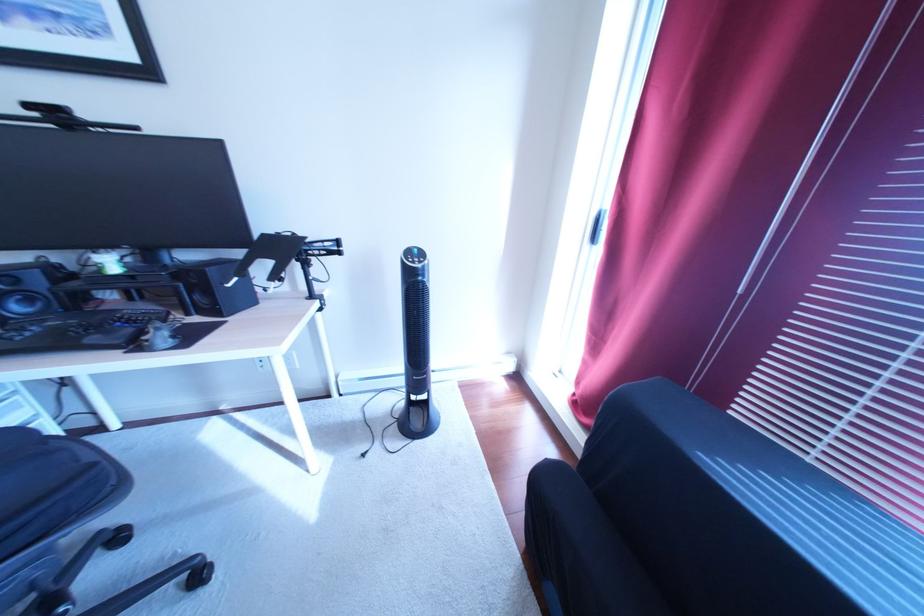
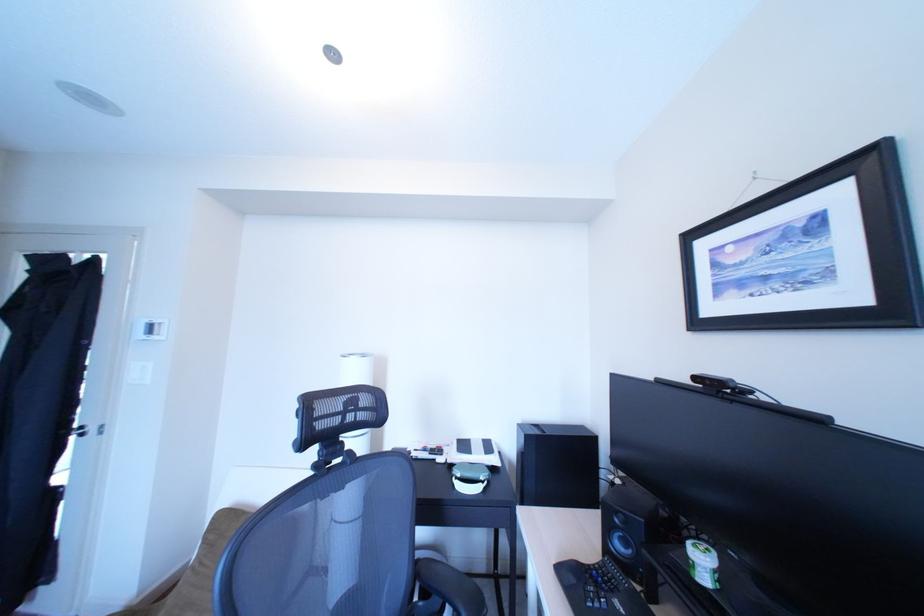
Question: The camera is either moving clockwise (left) or counter-clockwise (right) around the object. The first image is from the beginning of the video and the second image is from the end. Is the camera moving left or right when shooting the video?

Choices:
 (A) Left
 (B) Right

Answer: (B)